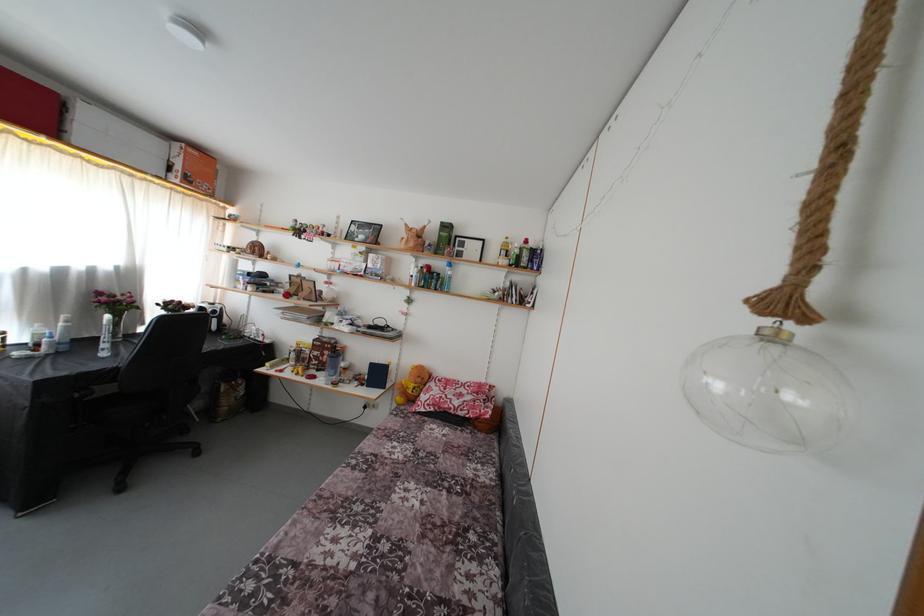
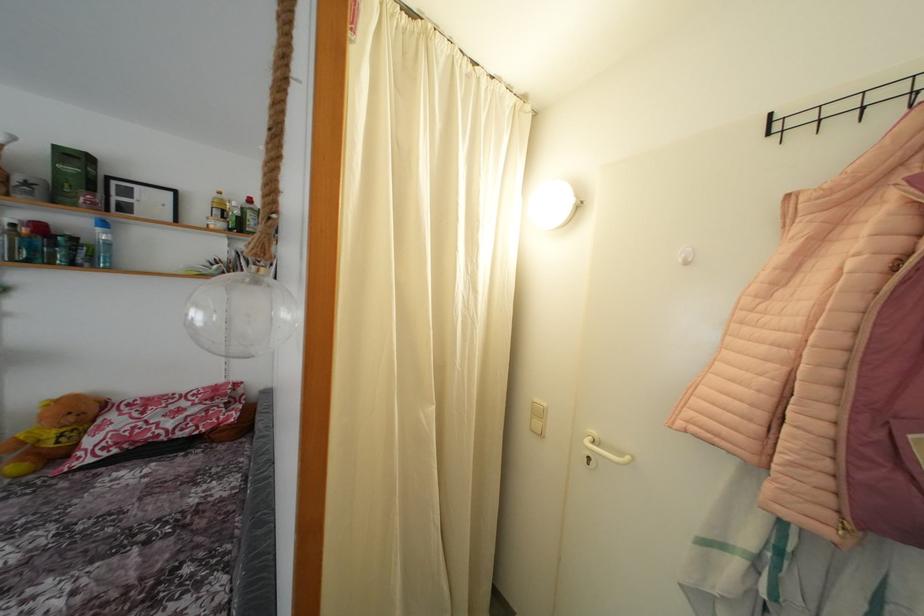
In the second image, find the point that corresponds to (512,244) in the first image.

(225, 199)